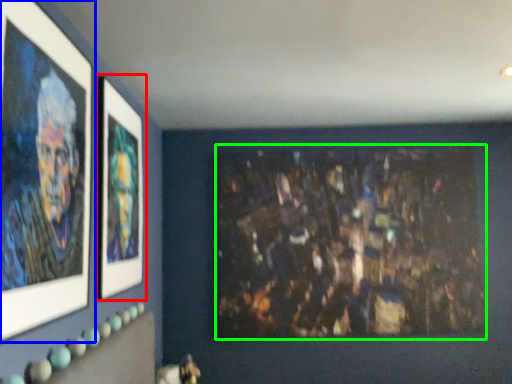
Question: Which object is positioned farthest from picture frame (highlighted by a red box)? Select from picture frame (highlighted by a blue box) and art (highlighted by a green box).

Choices:
 (A) picture frame
 (B) art

Answer: (B)